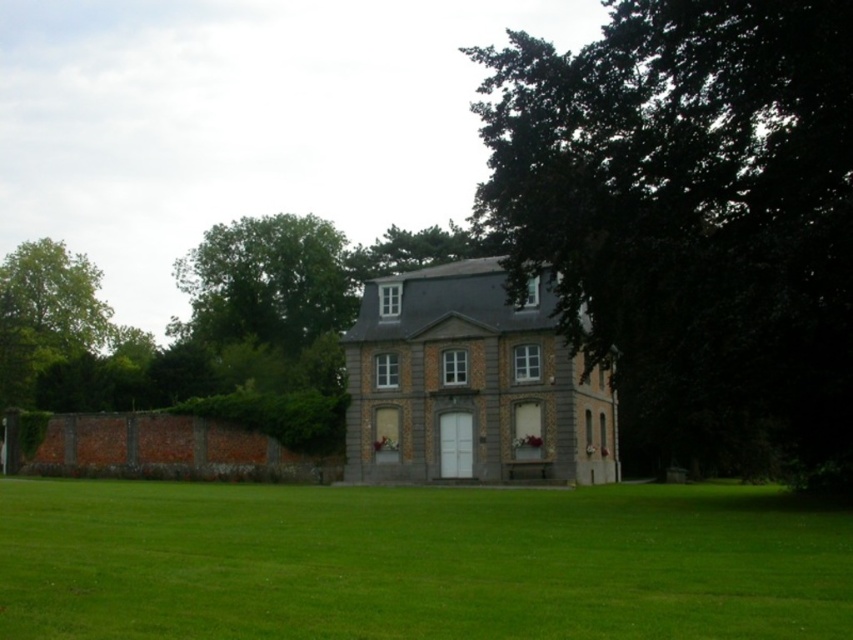
You are a landscape architect designing a garden for this house. You have a limited budget and must choose between planting the dark green leafy tree at upper right or the green grass at center. Which option is more cost effective based on their sizes?

The dark green leafy tree at upper right is thinner than the green grass at center, so the green grass at center requires more space and resources, making the dark green leafy tree at upper right the more cost effective choice.

Based on the scene description, where is the dark green leafy tree at upper right located in terms of coordinates?

The dark green leafy tree at upper right is located at coordinates point (692,218).